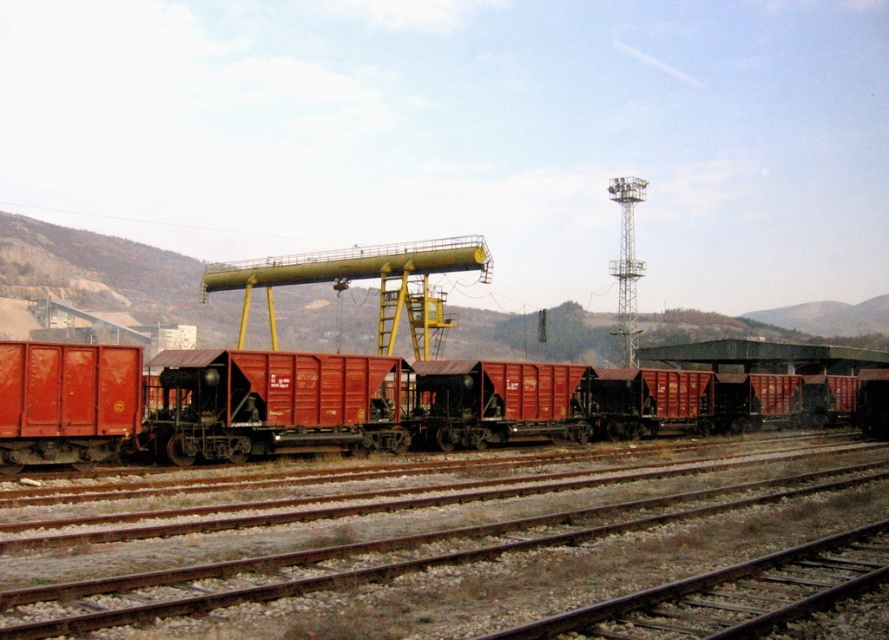
You are a railway inspector checking the layout of the tracks in the scene. You notice two tracks labeled as smooth metal tracks at center and smooth metal train track at lower right. Which of these tracks is wider?

The smooth metal tracks at center is larger in size than smooth metal train track at lower right, so the smooth metal tracks at center is wider.

You are a train conductor checking the railway tracks. You notice a point at coordinate (442, 545). Is this point located on the smooth metal tracks at center?

Yes, the point at coordinate (442, 545) is located on the smooth metal tracks at center as described.